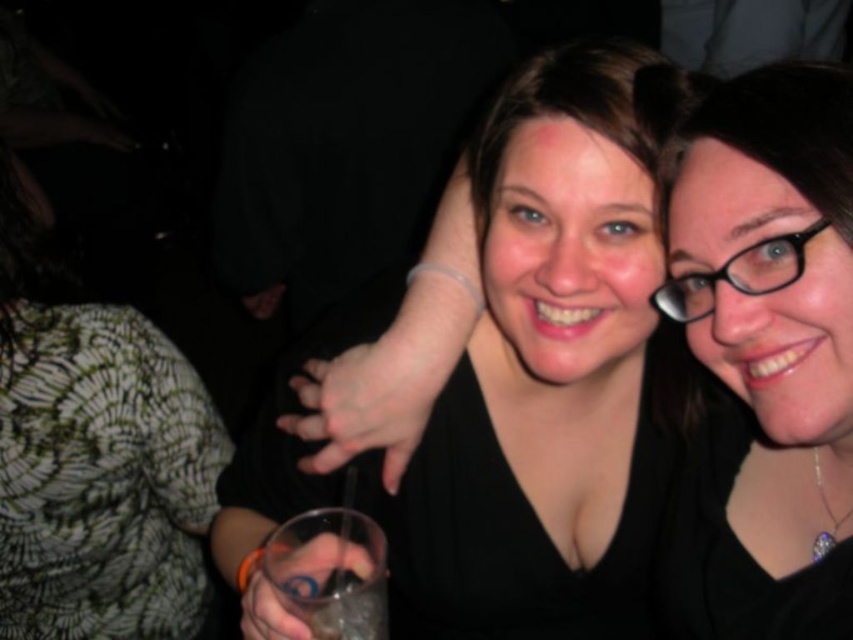
Based on the photo, you are at a party and need to decide which item to use for a drink. The clear plastic cup at center and the black plastic glasses at upper right are available. Which one can hold more liquid?

The clear plastic cup at center can hold more liquid because it is bigger than the black plastic glasses at upper right.

You are at a party and want to grab a drink. You see a clear plastic cup at center and black plastic glasses at upper right. Which object is closer to the left side of the image?

The clear plastic cup at center is closer to the left side of the image because it is positioned to the left of the black plastic glasses at upper right.